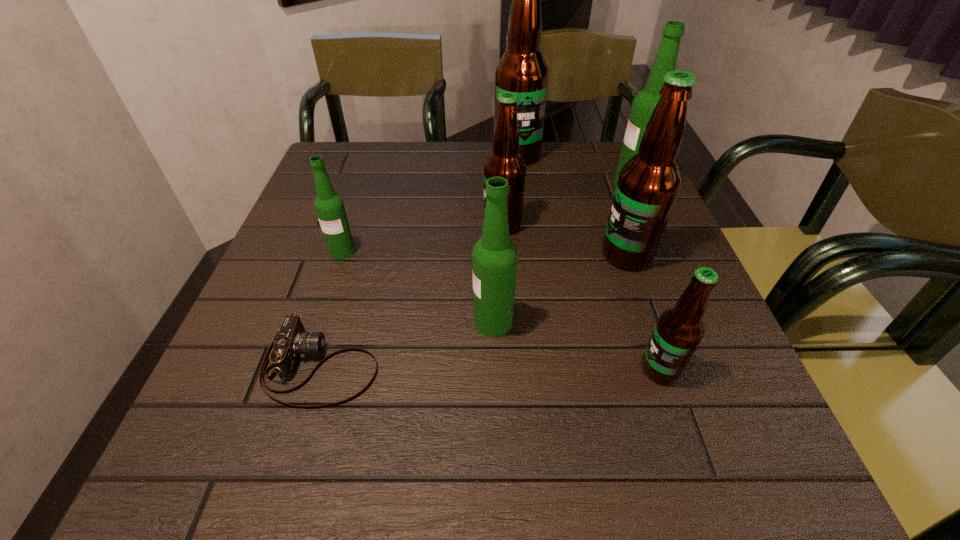
I want to click on the nearest beer bottle, so click(x=679, y=330).

This screenshot has height=540, width=960. I want to click on the second nearest green beer bottle, so click(x=329, y=206).

Locate an element on the screen. the leftmost beer bottle is located at coordinates click(329, 206).

You are a GUI agent. You are given a task and a screenshot of the screen. Output one action in this format:
    pyautogui.click(x=<x>, y=<y>)
    Task: Click on the shortest object
    
    Given the screenshot: What is the action you would take?
    pyautogui.click(x=291, y=342)

You are a GUI agent. You are given a task and a screenshot of the screen. Output one action in this format:
    pyautogui.click(x=<x>, y=<y>)
    Task: Click on the camera
    The image size is (960, 540).
    Given the screenshot: What is the action you would take?
    pyautogui.click(x=291, y=342)

Where is `free region located on the label of the farthest brown beer bottle`? free region located on the label of the farthest brown beer bottle is located at coordinates (520, 189).

You are a GUI agent. You are given a task and a screenshot of the screen. Output one action in this format:
    pyautogui.click(x=<x>, y=<y>)
    Task: Click on the vacant space positioned 0.090m on the label of the farthest green beer bottle
    
    Given the screenshot: What is the action you would take?
    pyautogui.click(x=579, y=185)

Find the location of a particular element. The height and width of the screenshot is (540, 960). vacant space located on the label of the farthest green beer bottle is located at coordinates (540, 185).

Find the location of a particular element. vacant region located 0.130m on the label of the farthest green beer bottle is located at coordinates (563, 185).

I want to click on free location located 0.150m on the label of the third farthest brown beer bottle, so click(531, 255).